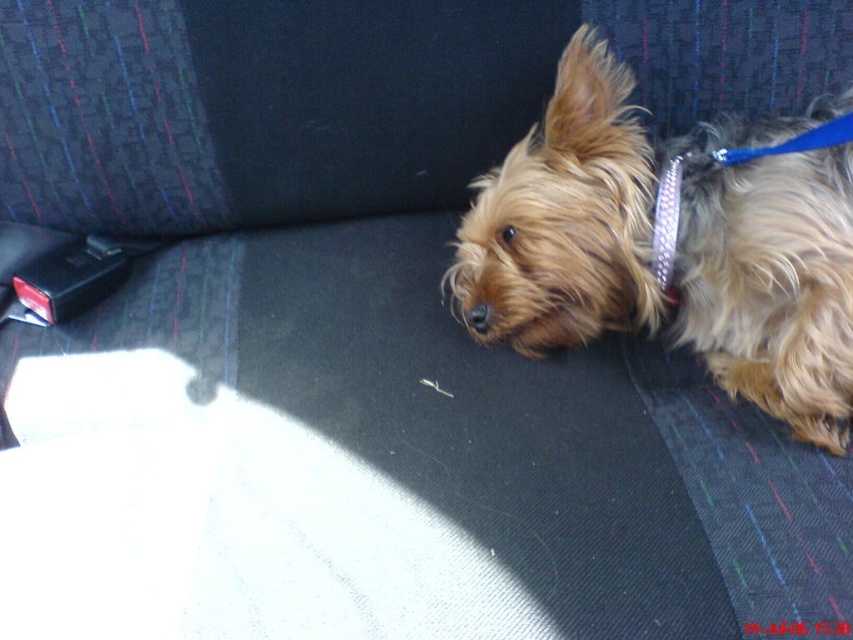
The scene shows a small dog lying on the back seat of a vehicle. The dog has a light brown, shaggy coat and is wearing two items around its neck. You are a veterinarian examining the dog. Which of the two items, the blue metallic collar at upper right or the glittery silver neckband at upper right, is more likely to pose a choking hazard if the dog tries to chew on it?

The glittery silver neckband at upper right is more likely to pose a choking hazard because it is smaller in size compared to the blue metallic collar at upper right, making it easier for the dog to swallow or get tangled.

You are designing a custom collar for the fuzzy brown dog at center. The current glittery silver neckband at upper right is too small. What should you consider when making the new collar?

Since the fuzzy brown dog at center might be wider than the glittery silver neckband at upper right, the new collar should be wider to accommodate the dog comfortably.